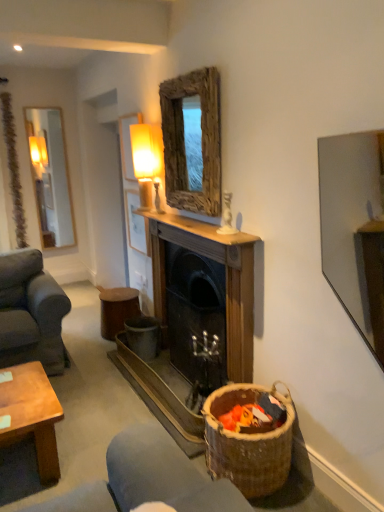
At what (x,y) coordinates should I click in order to perform the action: click on free space on the front side of wooden stool at center. Please return your answer as a coordinate pair (x, y). Looking at the image, I should click on (97, 351).